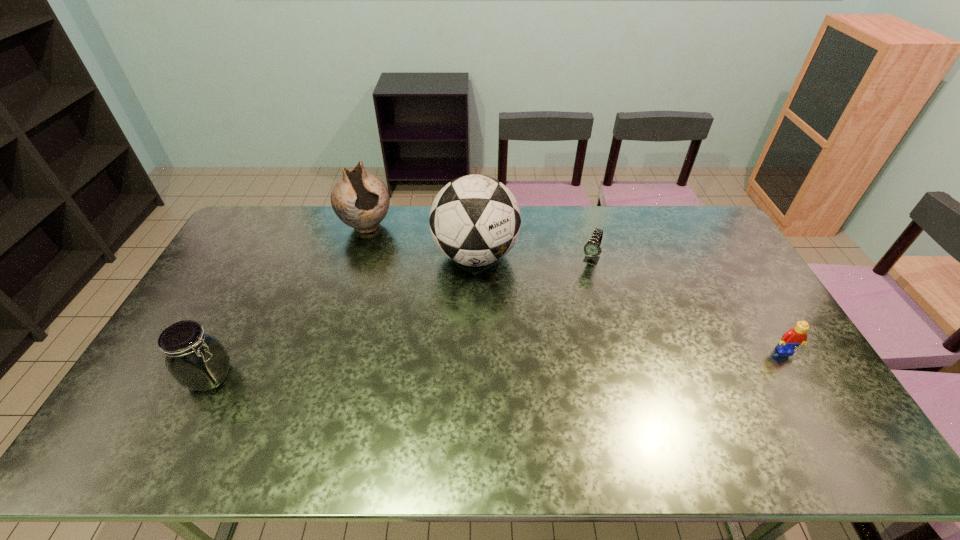
The height and width of the screenshot is (540, 960). Find the location of `vacant region located on the surface of the third object from left to right where the brand logo is visible`. vacant region located on the surface of the third object from left to right where the brand logo is visible is located at coordinates (473, 364).

The height and width of the screenshot is (540, 960). What are the coordinates of `free space located on the surface of the third object from left to right where the brand logo is visible` in the screenshot? It's located at (473, 387).

The image size is (960, 540). Identify the location of vacant point located 0.270m from the spout of the second object from left to right. (400, 289).

The height and width of the screenshot is (540, 960). I want to click on free space located from the spout of the second object from left to right, so click(382, 256).

Locate an element on the screen. free space located 0.380m from the spout of the second object from left to right is located at coordinates (412, 312).

The width and height of the screenshot is (960, 540). What are the coordinates of `free space located on the face of the watch` in the screenshot? It's located at (564, 321).

The width and height of the screenshot is (960, 540). Find the location of `vacant space located 0.220m on the face of the watch`. vacant space located 0.220m on the face of the watch is located at coordinates (568, 312).

This screenshot has height=540, width=960. I want to click on free space located 0.080m on the face of the watch, so click(x=581, y=284).

I want to click on soccer ball at the far edge, so click(475, 220).

The height and width of the screenshot is (540, 960). Identify the location of pottery that is at the far edge. (361, 200).